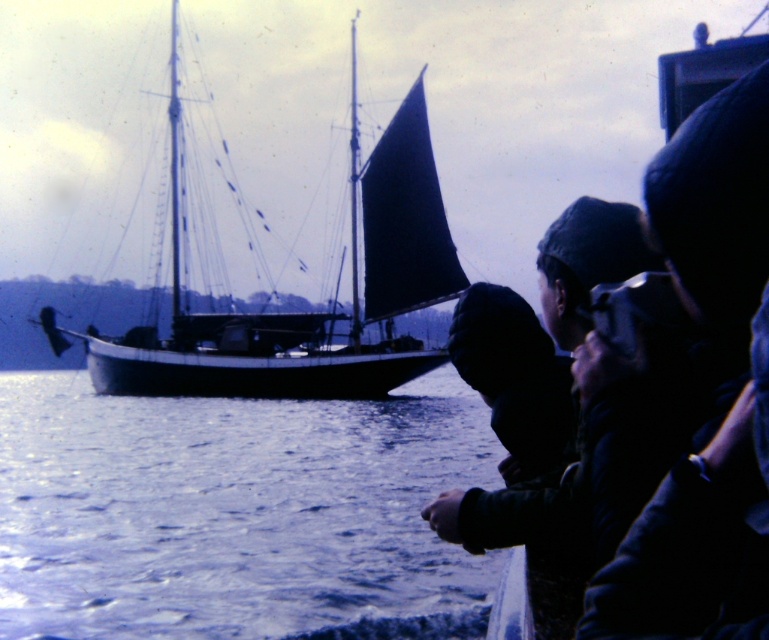
At what (x,y) coordinates should I click in order to perform the action: click on blue water at lower left. Please return your answer as a coordinate pair (x, y). Looking at the image, I should click on (235, 513).

Does blue water at lower left appear on the left side of dark blue canvas sailboat at left?

No, blue water at lower left is not to the left of dark blue canvas sailboat at left.

Is point (145, 577) closer to camera compared to point (375, 269)?

That is True.

You are a GUI agent. You are given a task and a screenshot of the screen. Output one action in this format:
    pyautogui.click(x=<x>, y=<y>)
    Task: Click on the blue water at lower left
    The image size is (769, 640).
    Given the screenshot: What is the action you would take?
    pyautogui.click(x=235, y=513)